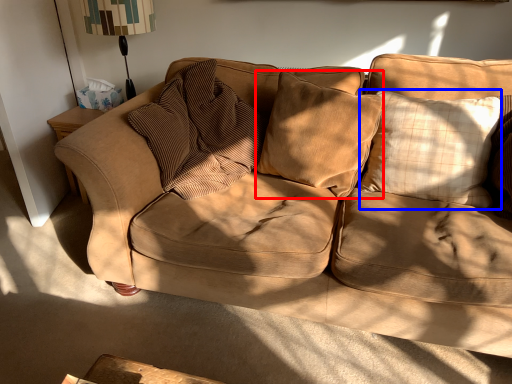
Question: Among these objects, which one is nearest to the camera, pillow (highlighted by a red box) or pillow (highlighted by a blue box)?

Choices:
 (A) pillow
 (B) pillow

Answer: (B)